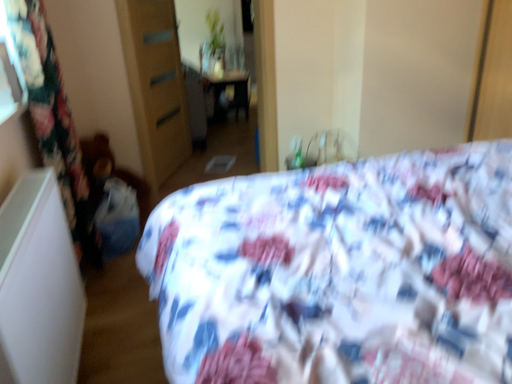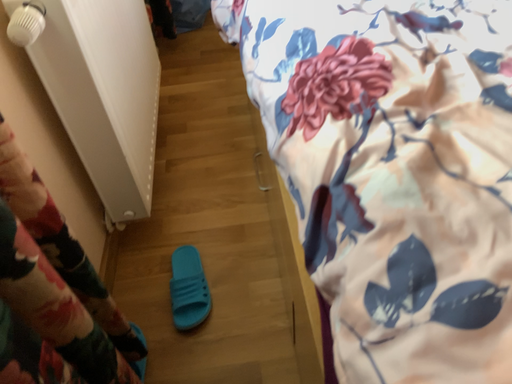
Question: How did the camera likely rotate when shooting the video?

Choices:
 (A) rotated right
 (B) rotated left

Answer: (B)